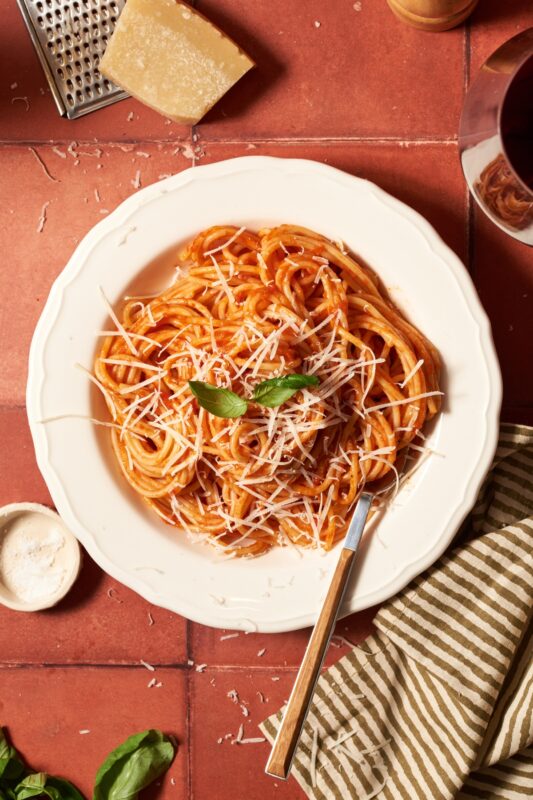
Find the location of a particular element. The image size is (533, 800). white porcelain bowl is located at coordinates (441, 302).